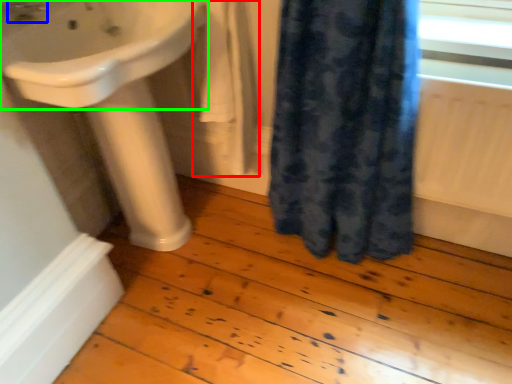
Question: Which object is the farthest from bath towel (highlighted by a red box)? Choose among these: tap (highlighted by a blue box) or sink (highlighted by a green box).

Choices:
 (A) tap
 (B) sink

Answer: (A)